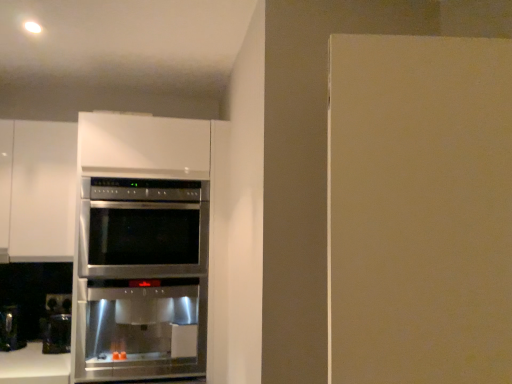
Question: Can you confirm if stainless steel oven at center is shorter than black glossy coffee machine at lower left?

Choices:
 (A) no
 (B) yes

Answer: (A)

Question: Considering the relative sizes of stainless steel oven at center and black glossy coffee machine at lower left in the image provided, is stainless steel oven at center smaller than black glossy coffee machine at lower left?

Choices:
 (A) yes
 (B) no

Answer: (B)

Question: From a real-world perspective, is stainless steel oven at center positioned over black glossy coffee machine at lower left based on gravity?

Choices:
 (A) yes
 (B) no

Answer: (A)

Question: Is stainless steel oven at center to the right of black glossy coffee machine at lower left from the viewer's perspective?

Choices:
 (A) yes
 (B) no

Answer: (A)

Question: Does stainless steel oven at center have a larger size compared to black glossy coffee machine at lower left?

Choices:
 (A) yes
 (B) no

Answer: (A)

Question: Is the position of stainless steel oven at center less distant than that of black glossy coffee machine at lower left?

Choices:
 (A) no
 (B) yes

Answer: (B)

Question: Are black glossy coffee machine at lower left and stainless steel oven at center making contact?

Choices:
 (A) yes
 (B) no

Answer: (B)

Question: Can you confirm if black glossy coffee machine at lower left is thinner than stainless steel oven at center?

Choices:
 (A) yes
 (B) no

Answer: (A)

Question: From a real-world perspective, is black glossy coffee machine at lower left on top of stainless steel oven at center?

Choices:
 (A) no
 (B) yes

Answer: (A)

Question: Does black glossy coffee machine at lower left appear on the left side of stainless steel oven at center?

Choices:
 (A) yes
 (B) no

Answer: (A)

Question: Considering the relative sizes of black glossy coffee machine at lower left and stainless steel oven at center in the image provided, is black glossy coffee machine at lower left wider than stainless steel oven at center?

Choices:
 (A) yes
 (B) no

Answer: (B)

Question: Does black glossy coffee machine at lower left have a lesser height compared to stainless steel oven at center?

Choices:
 (A) yes
 (B) no

Answer: (A)

Question: Is black glossy coffee machine at lower left wider or thinner than stainless steel oven at center?

Choices:
 (A) thin
 (B) wide

Answer: (A)